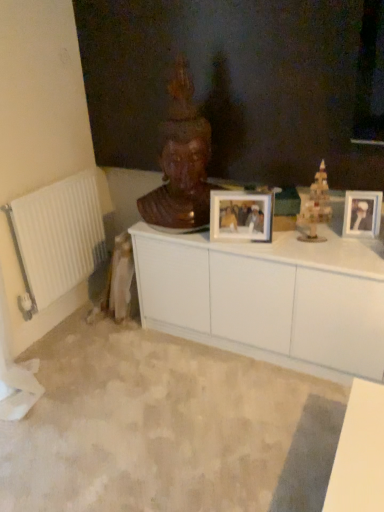
Question: From the image's perspective, is white plastic picture frame at upper right, the second picture frame in the left-to-right sequence, positioned above or below white glossy picture frame at center, acting as the second picture frame starting from the right?

Choices:
 (A) below
 (B) above

Answer: (B)

Question: From a real-world perspective, is white plastic picture frame at upper right, the second picture frame in the left-to-right sequence, physically located above or below white glossy picture frame at center, the first picture frame in the left-to-right sequence?

Choices:
 (A) above
 (B) below

Answer: (B)

Question: Estimate the real-world distances between objects in this image. Which object is farther from the white plastic picture frame at upper right, the second picture frame in the left-to-right sequence?

Choices:
 (A) white glossy picture frame at center, the first picture frame in the left-to-right sequence
 (B) wooden tower at upper right
 (C) wooden statue at center
 (D) white matte cabinet at center
 (E) white metal radiator at left

Answer: (E)

Question: Which object is positioned closest to the white metal radiator at left?

Choices:
 (A) white glossy picture frame at center, acting as the second picture frame starting from the right
 (B) wooden statue at center
 (C) white plastic picture frame at upper right, the second picture frame in the left-to-right sequence
 (D) white matte cabinet at center
 (E) wooden tower at upper right

Answer: (B)